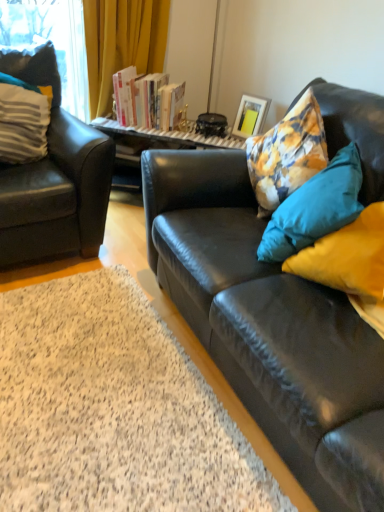
What do you see at coordinates (315, 208) in the screenshot? This screenshot has width=384, height=512. I see `floral fabric cushion at right, which ranks as the first pillow in right-to-left order` at bounding box center [315, 208].

Identify the location of floral fabric cushion at right, acting as the 2th pillow starting from the left. pyautogui.click(x=315, y=208).

Measure the distance between white striped pillow at left, which is counted as the 2th pillow, starting from the right, and camera.

The depth of white striped pillow at left, which is counted as the 2th pillow, starting from the right, is 6.44 feet.

This screenshot has width=384, height=512. What do you see at coordinates (250, 116) in the screenshot?
I see `matte white picture frame at upper center` at bounding box center [250, 116].

Find the location of a particular element. The image size is (384, 512). matte white picture frame at upper center is located at coordinates (250, 116).

What are the coordinates of `floral fabric cushion at right, which ranks as the first pillow in right-to-left order` in the screenshot? It's located at (315, 208).

Considering the positions of objects black leather couch at right and matte white picture frame at upper center in the image provided, who is more to the right, black leather couch at right or matte white picture frame at upper center?

matte white picture frame at upper center is more to the right.

Is point (130, 488) closer to camera compared to point (260, 120)?

That is True.

In the scene shown: Considering the sizes of black leather couch at right and matte white picture frame at upper center in the image, is black leather couch at right bigger or smaller than matte white picture frame at upper center?

Considering their sizes, black leather couch at right takes up more space than matte white picture frame at upper center.

From the image's perspective, is black leather couch at right on top of matte white picture frame at upper center?

Actually, black leather couch at right appears below matte white picture frame at upper center in the image.

How far apart are matte black armchair at left and white striped pillow at left, which is counted as the 2th pillow, starting from the right?

matte black armchair at left and white striped pillow at left, which is counted as the 2th pillow, starting from the right, are 8.28 inches apart from each other.

Find the location of `chair in front of the white striped pillow at left, acting as the first pillow starting from the left`. chair in front of the white striped pillow at left, acting as the first pillow starting from the left is located at coordinates (54, 180).

From the image's perspective, is matte black armchair at left positioned above or below white striped pillow at left, acting as the first pillow starting from the left?

Clearly, from the image's perspective, matte black armchair at left is below white striped pillow at left, acting as the first pillow starting from the left.

What's the angular difference between matte black armchair at left and white striped pillow at left, which is counted as the 2th pillow, starting from the right,'s facing directions?

There is a 1.19-degree angle between the facing directions of matte black armchair at left and white striped pillow at left, which is counted as the 2th pillow, starting from the right.

From the image's perspective, is hardcover books at center beneath white striped pillow at left, acting as the first pillow starting from the left?

No, from the image's perspective, hardcover books at center is not beneath white striped pillow at left, acting as the first pillow starting from the left.

This screenshot has height=512, width=384. I want to click on pillow that is the 1st one when counting downward from the hardcover books at center (from the image's perspective), so click(x=23, y=120).

Is hardcover books at center in front of white striped pillow at left, acting as the first pillow starting from the left?

No, hardcover books at center is behind white striped pillow at left, acting as the first pillow starting from the left.

Looking at their sizes, would you say matte white picture frame at upper center is wider or thinner than black leather couch at right?

matte white picture frame at upper center is thinner than black leather couch at right.

Find the location of a particular element. This screenshot has width=384, height=512. picture frame positioned vertically above the black leather couch at right (from a real-world perspective) is located at coordinates (250, 116).

From a real-world perspective, is matte white picture frame at upper center on black leather couch at right?

Correct, in the physical world, matte white picture frame at upper center is higher than black leather couch at right.

From a real-world perspective, which is physically above, white striped pillow at left, which is counted as the 2th pillow, starting from the right, or hardcover books at center?

white striped pillow at left, which is counted as the 2th pillow, starting from the right, is physically above.

Considering the relative sizes of white striped pillow at left, acting as the first pillow starting from the left, and hardcover books at center in the image provided, is white striped pillow at left, acting as the first pillow starting from the left, wider than hardcover books at center?

Indeed, white striped pillow at left, acting as the first pillow starting from the left, has a greater width compared to hardcover books at center.

Does white striped pillow at left, which is counted as the 2th pillow, starting from the right, have a lesser height compared to hardcover books at center?

No.

Between hardcover books at center and matte white picture frame at upper center, which one has more height?

With more height is hardcover books at center.

How many degrees apart are the facing directions of hardcover books at center and matte white picture frame at upper center?

hardcover books at center and matte white picture frame at upper center are facing 30.7 degrees away from each other.

Does hardcover books at center appear on the left side of matte white picture frame at upper center?

Indeed, hardcover books at center is positioned on the left side of matte white picture frame at upper center.

From a real-world perspective, is hardcover books at center positioned under matte white picture frame at upper center based on gravity?

Actually, hardcover books at center is physically above matte white picture frame at upper center in the real world.

From a real-world perspective, relative to matte black armchair at left, is black leather couch at right vertically above or below?

From a real-world perspective, black leather couch at right is physically below matte black armchair at left.

Locate an element on the screen. studio couch below the matte black armchair at left (from the image's perspective) is located at coordinates (269, 327).

Considering the positions of objects black leather couch at right and matte black armchair at left in the image provided, who is more to the right, black leather couch at right or matte black armchair at left?

black leather couch at right.

Does point (204, 222) appear closer or farther from the camera than point (39, 258)?

Clearly, point (204, 222) is closer to the camera than point (39, 258).

Find the location of a particular element. The width and height of the screenshot is (384, 512). picture frame above the black leather couch at right (from the image's perspective) is located at coordinates (250, 116).

At what (x,y) coordinates should I click in order to perform the action: click on pillow located on the left of matte black armchair at left. Please return your answer as a coordinate pair (x, y). Looking at the image, I should click on (23, 120).

Based on the photo, looking at the image, which one is located further to matte black armchair at left, black leather couch at right or black leather couch at right?

Among the two, black leather couch at right is located further to matte black armchair at left.

Which object lies further to the anchor point matte white picture frame at upper center, black leather couch at right or floral fabric cushion at right, which ranks as the first pillow in right-to-left order?

Based on the image, black leather couch at right appears to be further to matte white picture frame at upper center.

Considering their positions, is white striped pillow at left, acting as the first pillow starting from the left, positioned further to hardcover books at center than black leather couch at right?

black leather couch at right lies further to hardcover books at center than the other object.

Considering their positions, is matte white picture frame at upper center positioned further to floral fabric cushion at right, which ranks as the first pillow in right-to-left order, than matte black armchair at left?

matte black armchair at left is positioned further to the anchor floral fabric cushion at right, which ranks as the first pillow in right-to-left order.

Based on their spatial positions, is matte black armchair at left or floral fabric cushion at right, which ranks as the first pillow in right-to-left order, closer to black leather couch at right?

floral fabric cushion at right, which ranks as the first pillow in right-to-left order, lies closer to black leather couch at right than the other object.

Looking at this image, estimate the real-world distances between objects in this image. Which object is further from matte black armchair at left, floral fabric cushion at right, which ranks as the first pillow in right-to-left order, or black leather couch at right?

Based on the image, floral fabric cushion at right, which ranks as the first pillow in right-to-left order, appears to be further to matte black armchair at left.

Based on their spatial positions, is black leather couch at right or matte black armchair at left closer to white striped pillow at left, which is counted as the 2th pillow, starting from the right?

matte black armchair at left is closer to white striped pillow at left, which is counted as the 2th pillow, starting from the right.

Estimate the real-world distances between objects in this image. Which object is closer to hardcover books at center, black leather couch at right or white striped pillow at left, acting as the first pillow starting from the left?

white striped pillow at left, acting as the first pillow starting from the left.

Locate an element on the screen. This screenshot has width=384, height=512. book situated between white striped pillow at left, acting as the first pillow starting from the left, and floral fabric cushion at right, which ranks as the first pillow in right-to-left order, from left to right is located at coordinates (147, 100).

At what (x,y) coordinates should I click in order to perform the action: click on plain located between black leather couch at right and matte white picture frame at upper center in the depth direction. Please return your answer as a coordinate pair (x, y). Looking at the image, I should click on (113, 409).

Find the location of `pillow situated between matte black armchair at left and black leather couch at right from left to right`. pillow situated between matte black armchair at left and black leather couch at right from left to right is located at coordinates (315, 208).

You are a GUI agent. You are given a task and a screenshot of the screen. Output one action in this format:
    pyautogui.click(x=<x>, y=<y>)
    Task: Click on the chair between black leather couch at right and hardcover books at center along the z-axis
    
    Given the screenshot: What is the action you would take?
    pyautogui.click(x=54, y=180)